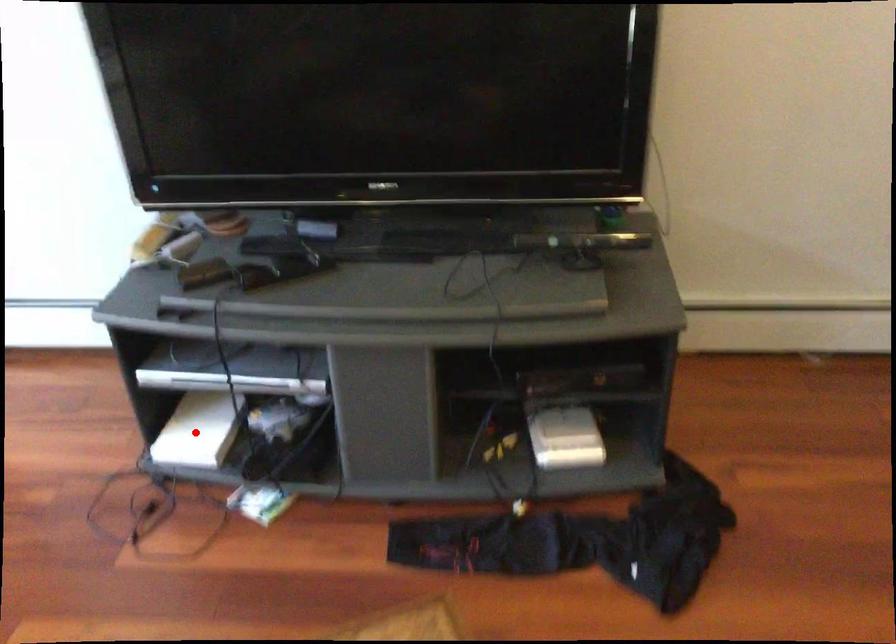
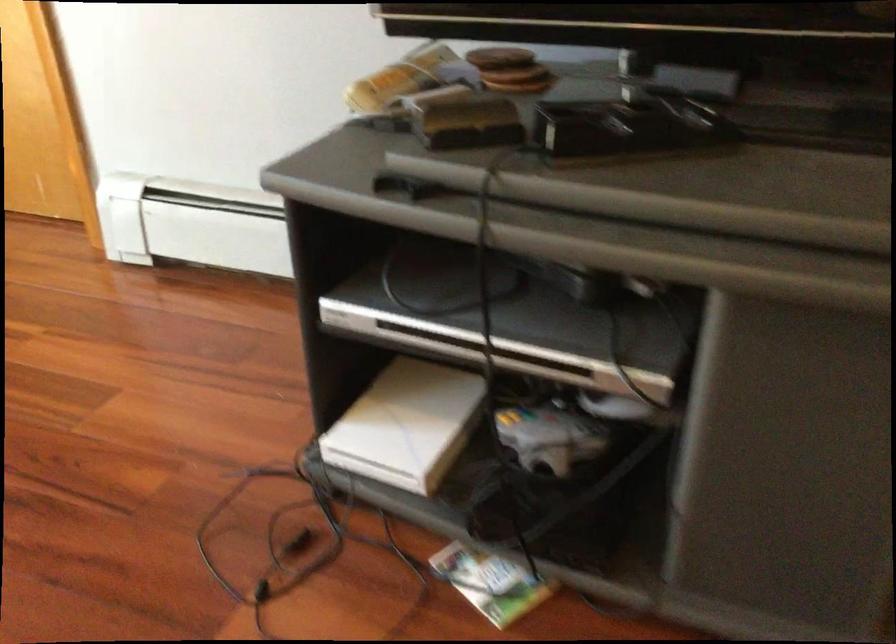
The point at the highlighted location is marked in the first image. Where is the corresponding point in the second image?

(407, 424)